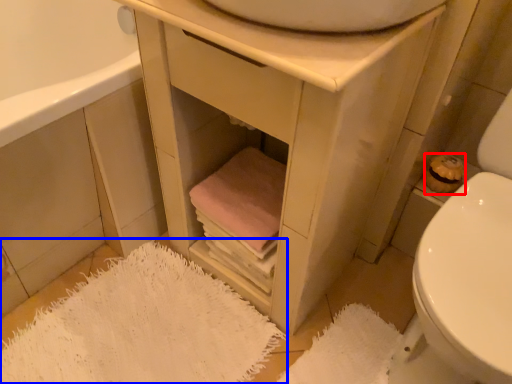
Question: Which of the following is the closest to the observer, toilet paper (highlighted by a red box) or bath mat (highlighted by a blue box)?

Choices:
 (A) toilet paper
 (B) bath mat

Answer: (B)